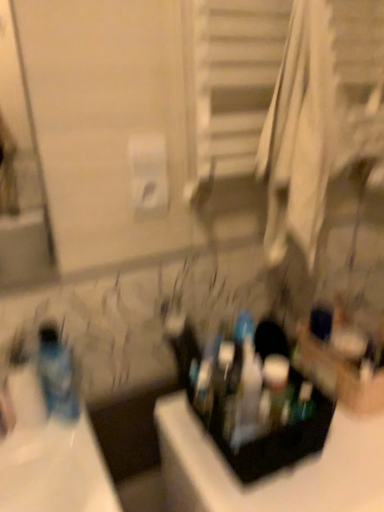
You are a GUI agent. You are given a task and a screenshot of the screen. Output one action in this format:
    pyautogui.click(x=<x>, y=<y>)
    Task: Click on the free location to the right of translucent plastic toothbrush at center
    This screenshot has height=512, width=384.
    Given the screenshot: What is the action you would take?
    (269, 402)